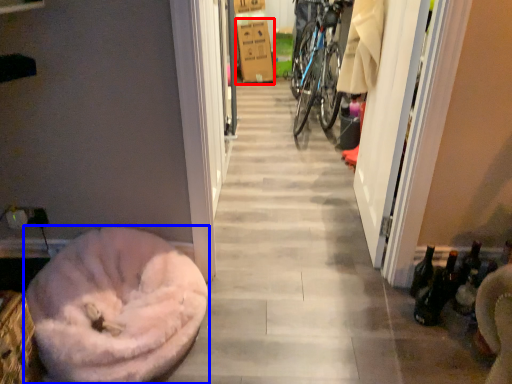
Question: Which of the following is the farthest to the observer, cardboard box (highlighted by a red box) or dog bed (highlighted by a blue box)?

Choices:
 (A) cardboard box
 (B) dog bed

Answer: (A)